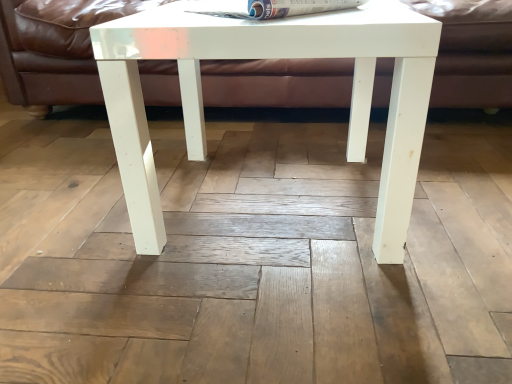
Locate an element on the screen. This screenshot has height=384, width=512. free space to the back side of white glossy table at center is located at coordinates (267, 134).